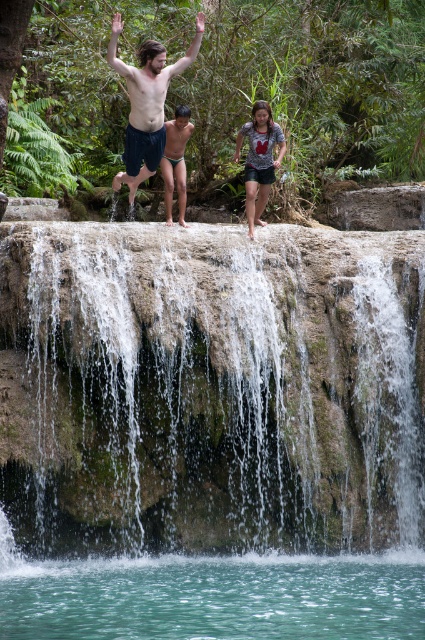
Question: Does matte black shorts at center have a larger size compared to gray printed shirt at center?

Choices:
 (A) no
 (B) yes

Answer: (B)

Question: Which object is the farthest from the clear water at center?

Choices:
 (A) gray printed shirt at center
 (B) matte blue shorts at center

Answer: (B)

Question: From the image, what is the correct spatial relationship of matte black shorts at center in relation to gray printed shirt at center?

Choices:
 (A) below
 (B) above

Answer: (B)

Question: Estimate the real-world distances between objects in this image. Which object is closer to the gray printed shirt at center?

Choices:
 (A) matte black shorts at center
 (B) green mossy rock at center

Answer: (A)

Question: Among these objects, which one is farthest from the camera?

Choices:
 (A) matte green swim trunks at center
 (B) gray printed shirt at center

Answer: (A)

Question: Does green mossy rock at center have a lesser width compared to clear water at center?

Choices:
 (A) yes
 (B) no

Answer: (B)